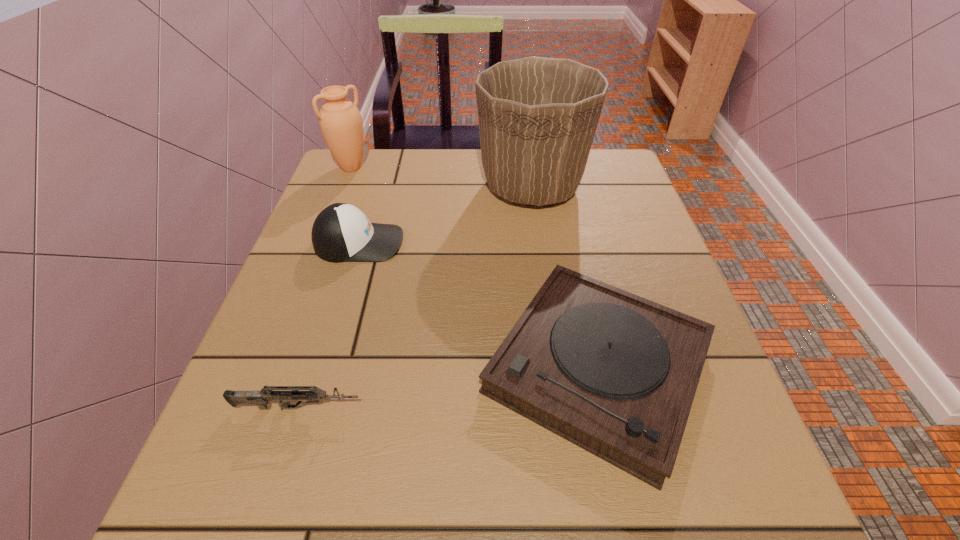
Where is `free space that satisfies the following two spatial constraints: 1. on the front side of the phonograph record; 2. aimed along the barrel of the gun`? Image resolution: width=960 pixels, height=540 pixels. free space that satisfies the following two spatial constraints: 1. on the front side of the phonograph record; 2. aimed along the barrel of the gun is located at coordinates (607, 408).

Locate an element on the screen. The image size is (960, 540). free spot that satisfies the following two spatial constraints: 1. on the front side of the phonograph record; 2. on the left side of the urn is located at coordinates (274, 367).

This screenshot has width=960, height=540. Find the location of `vacant area that satisfies the following two spatial constraints: 1. on the front side of the flowerpot; 2. on the front panel of the cap`. vacant area that satisfies the following two spatial constraints: 1. on the front side of the flowerpot; 2. on the front panel of the cap is located at coordinates (540, 242).

The height and width of the screenshot is (540, 960). What are the coordinates of `vacant space that satisfies the following two spatial constraints: 1. on the front panel of the third shortest object; 2. on the back side of the phonograph record` in the screenshot? It's located at (322, 367).